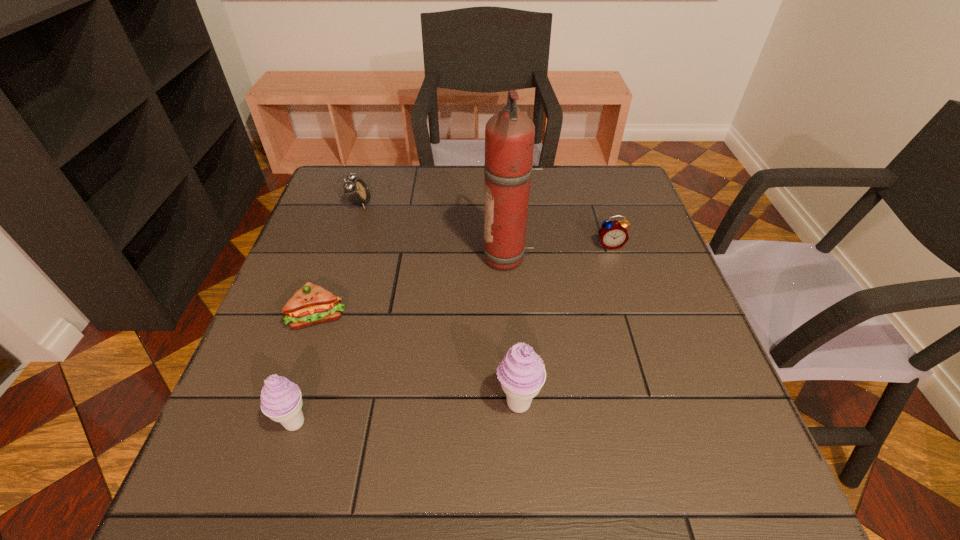
Where is `vacant space located 0.210m on the right of the left icecream`? The height and width of the screenshot is (540, 960). vacant space located 0.210m on the right of the left icecream is located at coordinates (430, 422).

You are a GUI agent. You are given a task and a screenshot of the screen. Output one action in this format:
    pyautogui.click(x=<x>, y=<y>)
    Task: Click on the vacant space situated 0.380m on the left of the right icecream
    
    Given the screenshot: What is the action you would take?
    pyautogui.click(x=291, y=403)

You are a GUI agent. You are given a task and a screenshot of the screen. Output one action in this format:
    pyautogui.click(x=<x>, y=<y>)
    Task: Click on the free space located on the face of the left alarm clock
    The image size is (960, 540).
    Given the screenshot: What is the action you would take?
    pyautogui.click(x=479, y=204)

Where is `free region located 0.120m on the front-facing side of the rightmost object`? Image resolution: width=960 pixels, height=540 pixels. free region located 0.120m on the front-facing side of the rightmost object is located at coordinates (622, 284).

At what (x,y) coordinates should I click in order to perform the action: click on vacant point located on the side of the fire extinguisher with the label and nozzle. Please return your answer as a coordinate pair (x, y). The height and width of the screenshot is (540, 960). Looking at the image, I should click on [x=396, y=259].

At what (x,y) coordinates should I click in order to perform the action: click on free spot located 0.250m on the side of the fire extinguisher with the label and nozzle. Please return your answer as a coordinate pair (x, y). The height and width of the screenshot is (540, 960). Looking at the image, I should click on (383, 259).

Identify the location of free region located on the side of the fire extinguisher with the label and nozzle. Image resolution: width=960 pixels, height=540 pixels. (444, 259).

Identify the location of vacant space situated 0.100m on the right of the sandwich. The height and width of the screenshot is (540, 960). (392, 316).

At what (x,y) coordinates should I click in order to perform the action: click on object that is at the far edge. Please return your answer as a coordinate pair (x, y). Looking at the image, I should click on (357, 192).

At what (x,y) coordinates should I click in order to perform the action: click on icecream located at the left edge. Please return your answer as a coordinate pair (x, y). This screenshot has height=540, width=960. Looking at the image, I should click on (281, 400).